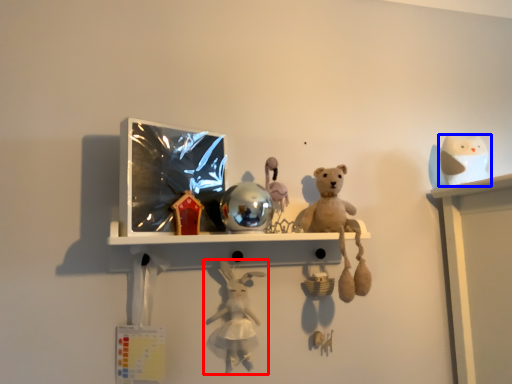
Question: Which object appears farthest to the camera in this image, toy (highlighted by a red box) or toy (highlighted by a blue box)?

Choices:
 (A) toy
 (B) toy

Answer: (B)